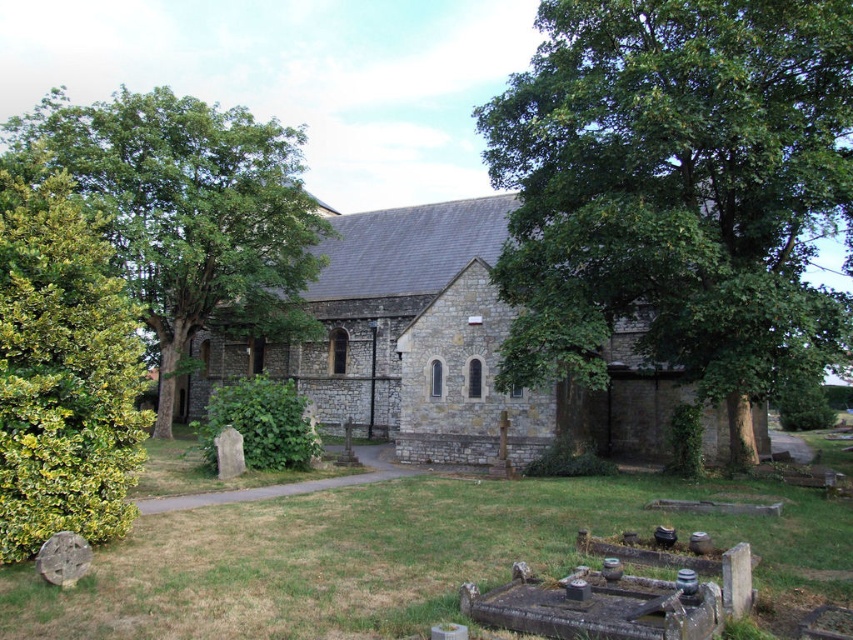
Does green leafy tree at center have a greater width compared to green leafy tree at left?

Incorrect, green leafy tree at center's width does not surpass green leafy tree at left's.

Is green leafy tree at center taller than green leafy tree at left?

No.

Locate an element on the screen. green leafy tree at center is located at coordinates (676, 189).

The image size is (853, 640). I want to click on green leafy tree at center, so click(676, 189).

This screenshot has height=640, width=853. What do you see at coordinates (190, 212) in the screenshot?
I see `green leafy tree at left` at bounding box center [190, 212].

Which of these two, green leafy tree at left or green leafy bush at left, stands taller?

green leafy tree at left

Where is `green leafy tree at left`? The height and width of the screenshot is (640, 853). green leafy tree at left is located at coordinates (190, 212).

Image resolution: width=853 pixels, height=640 pixels. Find the location of `green leafy tree at left`. green leafy tree at left is located at coordinates (190, 212).

Who is lower down, green leafy tree at center or green leafy bush at left?

Positioned lower is green leafy bush at left.

Which is in front, point (810, 256) or point (56, 205)?

Point (56, 205) is more forward.

Locate an element on the screen. green leafy tree at center is located at coordinates (676, 189).